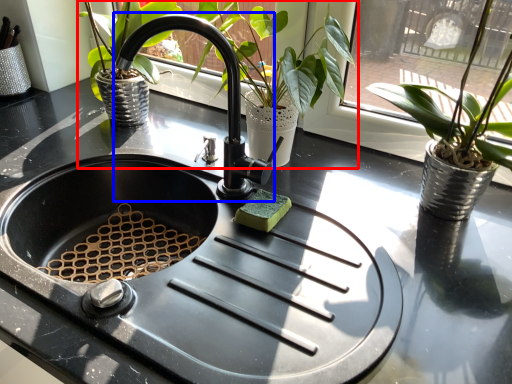
Question: Which of the following is the farthest to the observer, houseplant (highlighted by a red box) or faucet (highlighted by a blue box)?

Choices:
 (A) houseplant
 (B) faucet

Answer: (A)